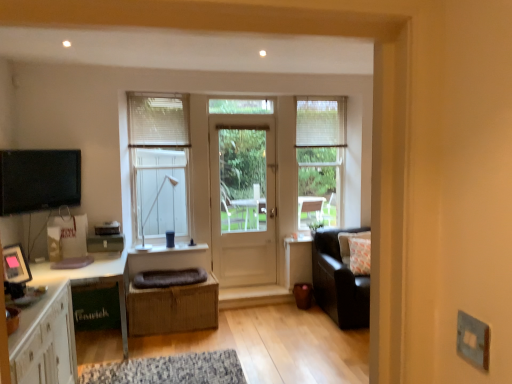
Question: Is white fabric curtain at upper center, which is the 2th curtain from front to back, inside or outside of white glossy cabinet at lower left?

Choices:
 (A) outside
 (B) inside

Answer: (A)

Question: From their relative heights in the image, would you say white fabric curtain at upper center, positioned as the second curtain in left-to-right order, is taller or shorter than white glossy cabinet at lower left?

Choices:
 (A) short
 (B) tall

Answer: (A)

Question: Which is nearer to the white textured blinds at upper right, which is counted as the third window, starting from the left?

Choices:
 (A) white glossy cabinet at lower left
 (B) clear glass door at center, the 2th window from the left
 (C) white paper bag at left
 (D) matte white window at center left, the 1th window viewed from the left
 (E) matte black tv at left

Answer: (B)

Question: Which object is positioned farthest from the white wooden door at center?

Choices:
 (A) white fabric curtain at upper left, arranged as the second curtain when viewed from the right
 (B) white fabric curtain at upper center, which is the 2th curtain from front to back
 (C) white textured blinds at upper right, which is counted as the third window, starting from the left
 (D) matte white window at center left, acting as the 3th window starting from the right
 (E) white glossy cabinet at lower left

Answer: (E)